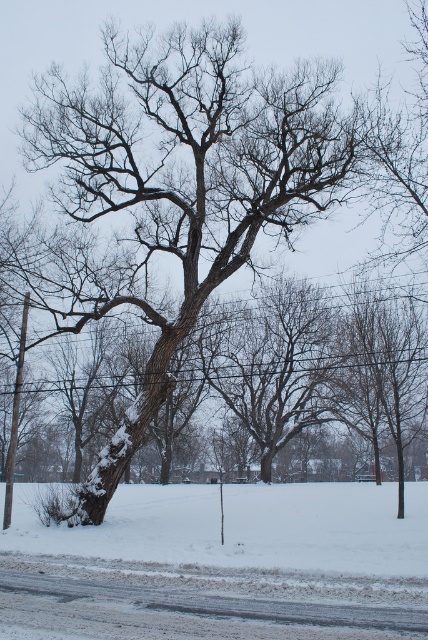
Is snow-covered bark tree at center to the left of white powdery snow at center from the viewer's perspective?

Indeed, snow-covered bark tree at center is positioned on the left side of white powdery snow at center.

Is snow-covered bark tree at center thinner than white powdery snow at center?

Correct, snow-covered bark tree at center's width is less than white powdery snow at center's.

Measure the distance between point (x=97, y=285) and camera.

Point (x=97, y=285) and camera are 19.96 meters apart from each other.

Locate an element on the screen. snow-covered bark tree at center is located at coordinates (178, 186).